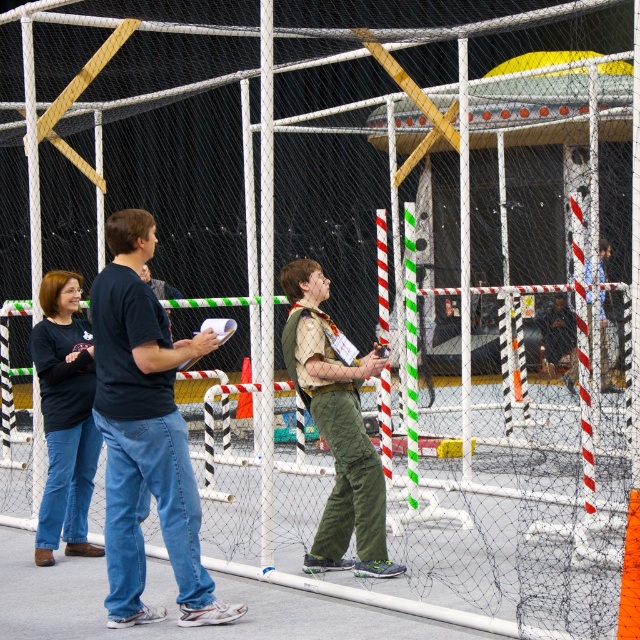
Is point (308, 321) positioned after point (84, 481)?

No, (308, 321) is closer to viewer.

Does khaki uniform at center have a lesser width compared to matte black shirt at left?

In fact, khaki uniform at center might be wider than matte black shirt at left.

Who is more distant from viewer, (360,378) or (84,321)?

Point (84,321)

I want to click on khaki uniform at center, so click(337, 426).

Does dark blue shirt at center have a greater width compared to khaki uniform at center?

Yes.

How far apart are dark blue shirt at center and khaki uniform at center?

dark blue shirt at center is 3.72 feet from khaki uniform at center.

Is point (125, 572) less distant than point (328, 528)?

Yes.

Where is `dark blue shirt at center`? This screenshot has height=640, width=640. dark blue shirt at center is located at coordinates (145, 433).

Is the position of dark blue shirt at center less distant than that of matte black shirt at left?

Yes, dark blue shirt at center is closer to the viewer.

Which is behind, point (173, 524) or point (83, 372)?

The point (83, 372) is more distant.

Where is `dark blue shirt at center`? The image size is (640, 640). dark blue shirt at center is located at coordinates (145, 433).